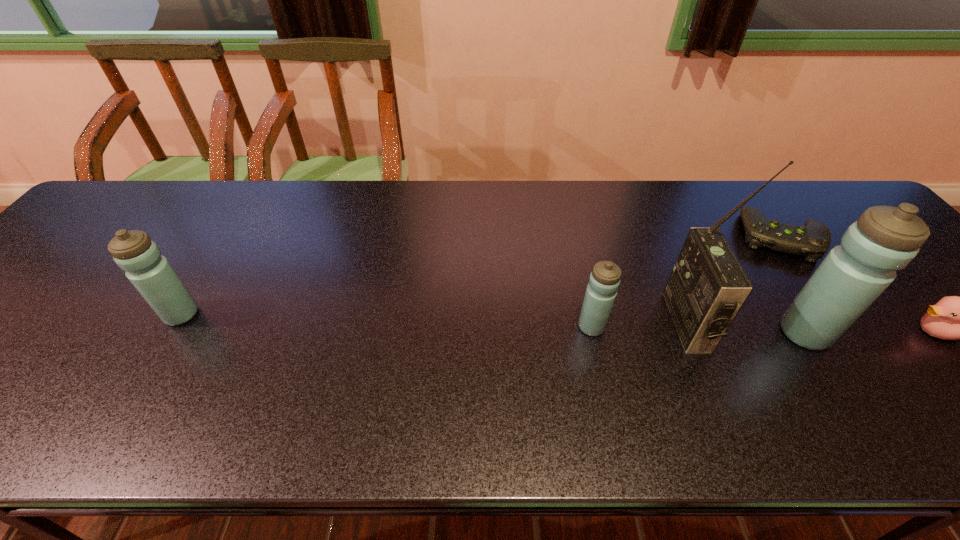
This screenshot has width=960, height=540. I want to click on free point that satisfies the following two spatial constraints: 1. on the display of the third object from left to right; 2. on the front side of the second water bottle from right to left, so click(689, 327).